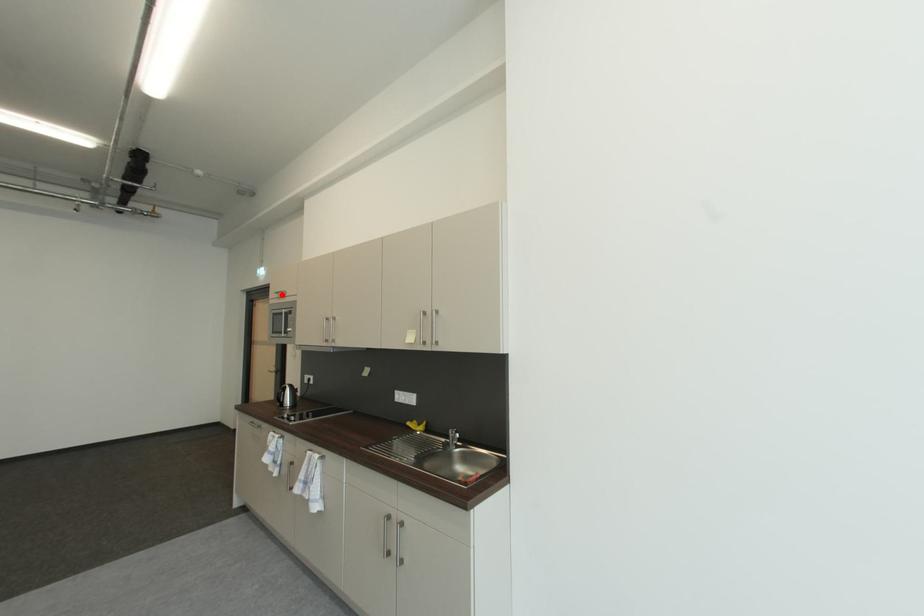
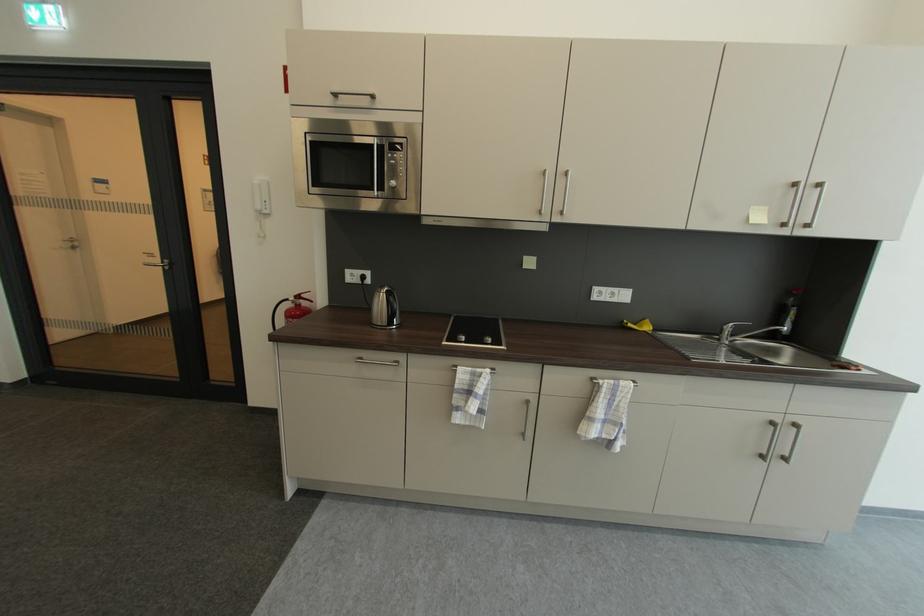
Find the pixel in the second image that matches the highlighted location in the first image.

(337, 95)